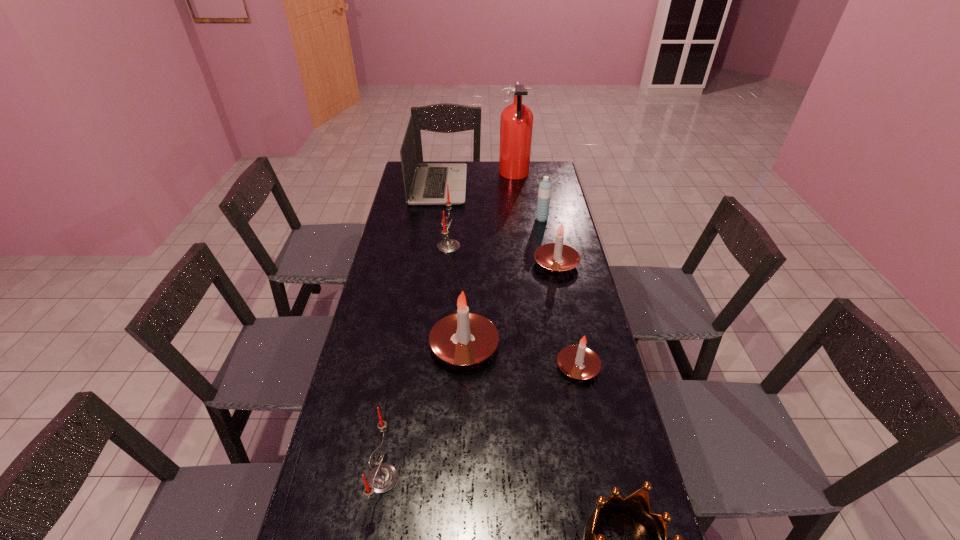
Locate an element on the screen. The height and width of the screenshot is (540, 960). the smallest white candle is located at coordinates (577, 361).

This screenshot has width=960, height=540. I want to click on the shortest object, so click(577, 361).

The height and width of the screenshot is (540, 960). In order to click on free space located on the left of the fire extinguisher in this screenshot , I will do `click(488, 175)`.

Locate an element on the screen. The width and height of the screenshot is (960, 540). free space located 0.340m on the screen of the laptop computer is located at coordinates (539, 186).

I want to click on vacant area situated 0.150m on the front of the leftmost white candle, so click(462, 421).

Where is `vacant point located on the front-facing side of the farther red candle`? This screenshot has height=540, width=960. vacant point located on the front-facing side of the farther red candle is located at coordinates (524, 246).

I want to click on vacant region located 0.080m on the front of the water bottle, so click(544, 233).

I want to click on vacant space located on the left of the farthest white candle, so (x=507, y=263).

The width and height of the screenshot is (960, 540). I want to click on vacant space located 0.270m on the front-facing side of the nearest candle, so click(513, 478).

The height and width of the screenshot is (540, 960). Find the location of `free space located on the back of the shortest candle`. free space located on the back of the shortest candle is located at coordinates (571, 333).